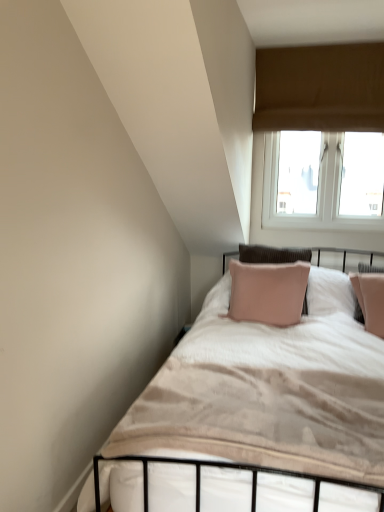
Identify the location of velvet beige bed at center. The height and width of the screenshot is (512, 384). (254, 414).

The height and width of the screenshot is (512, 384). Describe the element at coordinates (254, 414) in the screenshot. I see `velvet beige bed at center` at that location.

Where is `brown fabric window at upper right`? The height and width of the screenshot is (512, 384). brown fabric window at upper right is located at coordinates (320, 87).

Describe the element at coordinates (320, 87) in the screenshot. The width and height of the screenshot is (384, 512). I see `brown fabric window at upper right` at that location.

Find the location of a particular element. Image resolution: width=384 pixels, height=512 pixels. velvet beige bed at center is located at coordinates (254, 414).

Can you confirm if velvet beige bed at center is positioned to the left of brown fabric window at upper right?

Correct, you'll find velvet beige bed at center to the left of brown fabric window at upper right.

Considering the relative positions of velvet beige bed at center and brown fabric window at upper right in the image provided, is velvet beige bed at center behind brown fabric window at upper right?

No, velvet beige bed at center is in front of brown fabric window at upper right.

Which is closer, (300, 406) or (356, 69)?

Point (300, 406) is positioned closer to the camera compared to point (356, 69).

From the image's perspective, relative to brown fabric window at upper right, is velvet beige bed at center above or below?

From the image's perspective, velvet beige bed at center appears below brown fabric window at upper right.

From the picture: From a real-world perspective, which object rests below the other?

From a 3D spatial view, velvet beige bed at center is below.

Which object is wider, velvet beige bed at center or brown fabric window at upper right?

velvet beige bed at center.

Between velvet beige bed at center and brown fabric window at upper right, which one has more height?

Standing taller between the two is brown fabric window at upper right.

Between velvet beige bed at center and brown fabric window at upper right, which one has smaller size?

velvet beige bed at center.

Is velvet beige bed at center not inside brown fabric window at upper right?

That's correct, velvet beige bed at center is outside of brown fabric window at upper right.

Is velvet beige bed at center next to brown fabric window at upper right and touching it?

There is a gap between velvet beige bed at center and brown fabric window at upper right.

Is velvet beige bed at center oriented away from brown fabric window at upper right?

No, brown fabric window at upper right is not at the back of velvet beige bed at center.

What's the angular difference between velvet beige bed at center and brown fabric window at upper right's facing directions?

The angular difference between velvet beige bed at center and brown fabric window at upper right is 0.000885 degrees.

The image size is (384, 512). I want to click on window located above the velvet beige bed at center (from the image's perspective), so click(x=320, y=87).

Based on their positions, is brown fabric window at upper right located to the left or right of velvet beige bed at center?

brown fabric window at upper right is to the right of velvet beige bed at center.

Between brown fabric window at upper right and velvet beige bed at center, which one is positioned in front?

velvet beige bed at center.

Considering the positions of points (350, 86) and (372, 396), is point (350, 86) farther from camera compared to point (372, 396)?

Yes, point (350, 86) is farther from viewer.

Consider the image. From the image's perspective, does brown fabric window at upper right appear lower than velvet beige bed at center?

No, from the image's perspective, brown fabric window at upper right is not below velvet beige bed at center.

Looking at this image, from a real-world perspective, which is physically below, brown fabric window at upper right or velvet beige bed at center?

velvet beige bed at center.

Is brown fabric window at upper right thinner than velvet beige bed at center?

Yes.

Considering the sizes of objects brown fabric window at upper right and velvet beige bed at center in the image provided, who is taller, brown fabric window at upper right or velvet beige bed at center?

With more height is brown fabric window at upper right.

Does brown fabric window at upper right have a larger size compared to velvet beige bed at center?

Yes.

Choose the correct answer: Is brown fabric window at upper right inside velvet beige bed at center or outside it?

brown fabric window at upper right cannot be found inside velvet beige bed at center.

Is brown fabric window at upper right beside velvet beige bed at center?

No.

Could you tell me if brown fabric window at upper right is turned towards velvet beige bed at center?

Yes, brown fabric window at upper right is facing velvet beige bed at center.

Locate an element on the screen. The width and height of the screenshot is (384, 512). bed that is in front of the brown fabric window at upper right is located at coordinates (254, 414).

Where is `bed located underneath the brown fabric window at upper right (from a real-world perspective)`? This screenshot has height=512, width=384. bed located underneath the brown fabric window at upper right (from a real-world perspective) is located at coordinates (254, 414).

The image size is (384, 512). In order to click on window that is on the right side of velvet beige bed at center in this screenshot , I will do `click(320, 87)`.